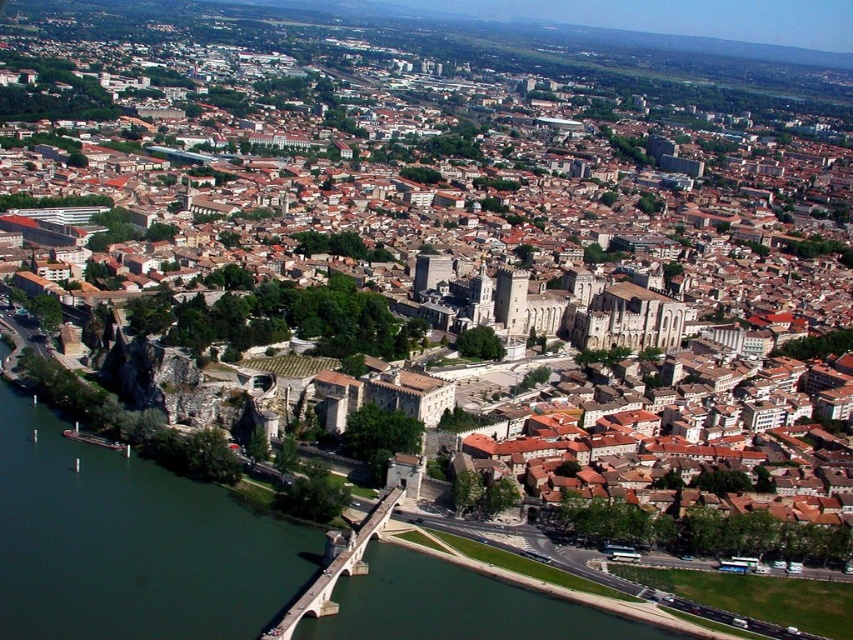
Question: Which point appears closest to the camera in this image?

Choices:
 (A) (309, 596)
 (B) (45, 460)

Answer: (A)

Question: Does green water at lower left appear over stone bridge at lower center?

Choices:
 (A) no
 (B) yes

Answer: (B)

Question: Is green water at lower left to the left of stone bridge at lower center from the viewer's perspective?

Choices:
 (A) no
 (B) yes

Answer: (B)

Question: Can you confirm if green water at lower left is positioned to the left of stone bridge at lower center?

Choices:
 (A) yes
 (B) no

Answer: (A)